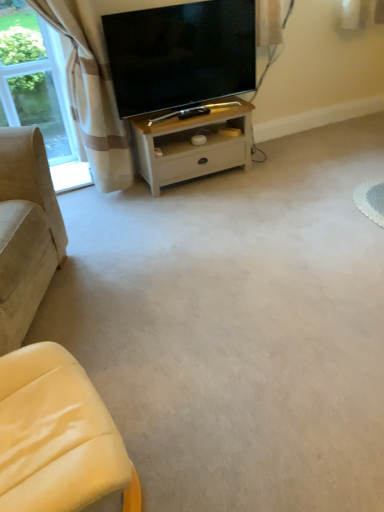
Locate an element on the screen. free point below beige plaid curtain at upper left (from a real-world perspective) is located at coordinates click(77, 199).